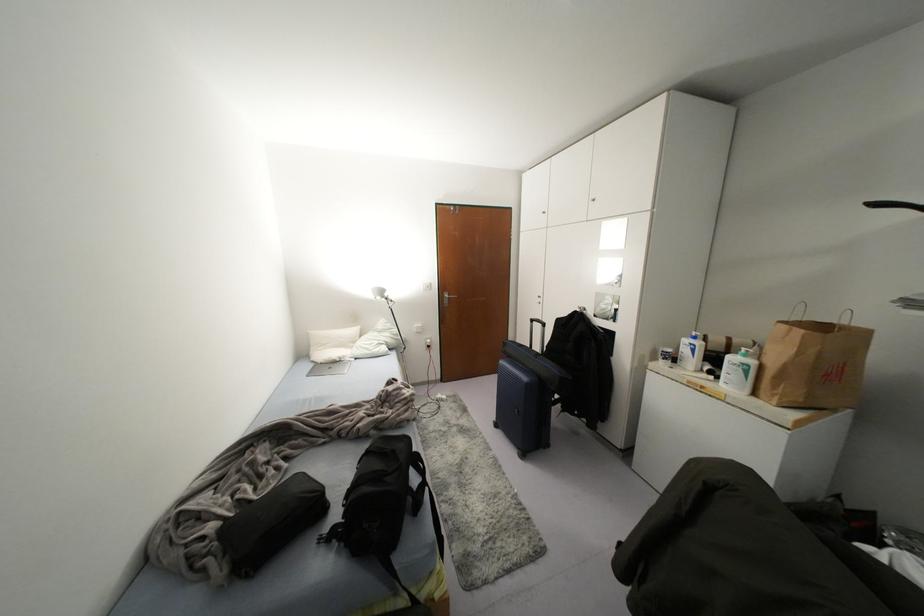
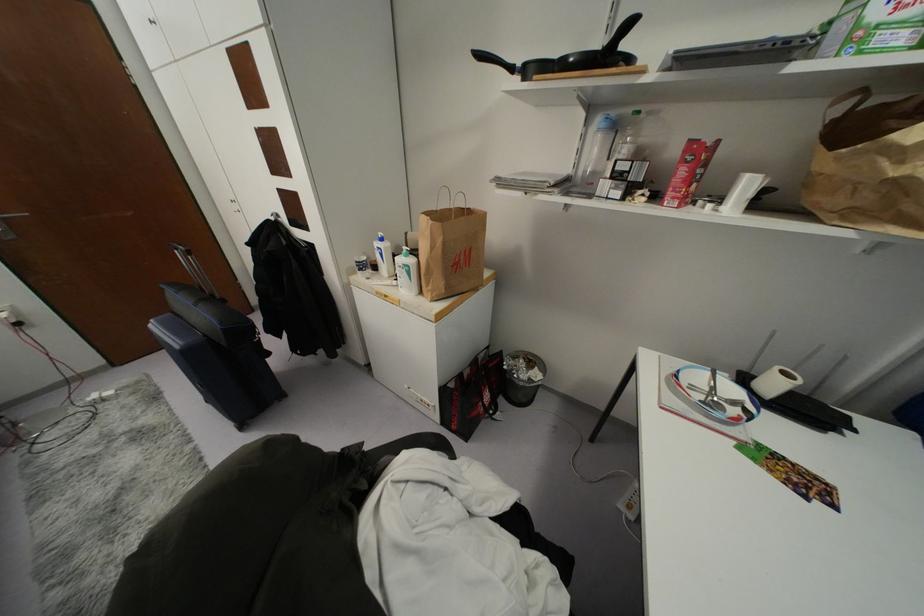
In the second image, find the point that corresponds to point (691, 350) in the first image.

(381, 254)